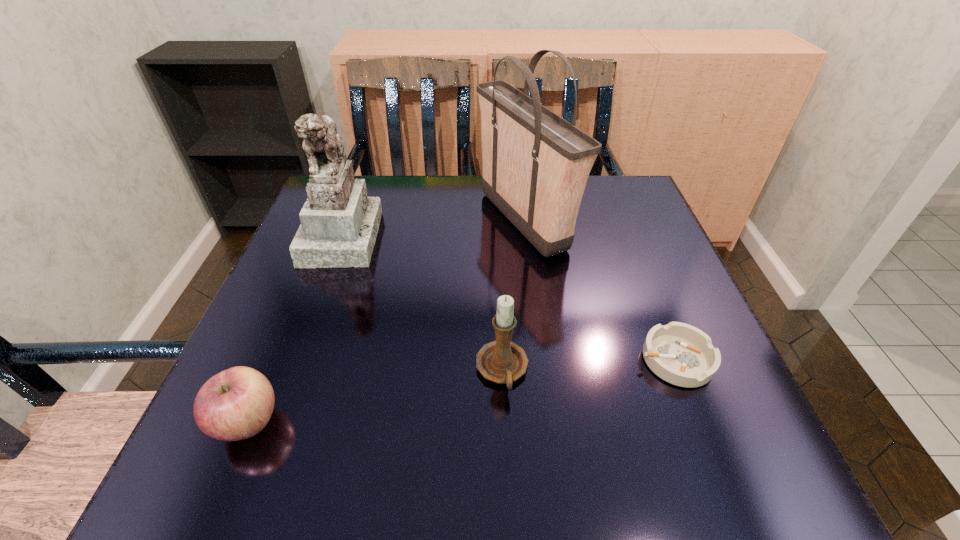
Find the location of a particular element. vacant area that lies between the apple and the shopping bag is located at coordinates (386, 321).

Find the location of a particular element. Image resolution: width=960 pixels, height=540 pixels. free spot between the candle holder and the second shortest object is located at coordinates (375, 396).

Identify the location of free spot between the fourth shortest object and the candle holder. Image resolution: width=960 pixels, height=540 pixels. (422, 303).

This screenshot has width=960, height=540. In order to click on vacant space in between the shopping bag and the figurine in this screenshot , I will do `click(433, 228)`.

Image resolution: width=960 pixels, height=540 pixels. I want to click on vacant region between the shopping bag and the shortest object, so click(x=599, y=290).

At what (x,y) coordinates should I click in order to perform the action: click on free space between the rightmost object and the third shortest object. Please return your answer as a coordinate pair (x, y). The width and height of the screenshot is (960, 540). Looking at the image, I should click on (588, 365).

Select which object appears as the fourth closest to the figurine. Please provide its 2D coordinates. Your answer should be formatted as a tuple, i.e. [(x, y)], where the tuple contains the x and y coordinates of a point satisfying the conditions above.

[(683, 355)]

Locate which object is the third closest to the rightmost object. Please provide its 2D coordinates. Your answer should be formatted as a tuple, i.e. [(x, y)], where the tuple contains the x and y coordinates of a point satisfying the conditions above.

[(339, 224)]

Locate an element on the screen. Image resolution: width=960 pixels, height=540 pixels. vacant position in the image that satisfies the following two spatial constraints: 1. on the front-facing side of the rightmost object; 2. on the right side of the figurine is located at coordinates (296, 360).

The height and width of the screenshot is (540, 960). What are the coordinates of `vacant area in the image that satisfies the following two spatial constraints: 1. on the front-facing side of the second tallest object; 2. on the left side of the shortest object` in the screenshot? It's located at (296, 360).